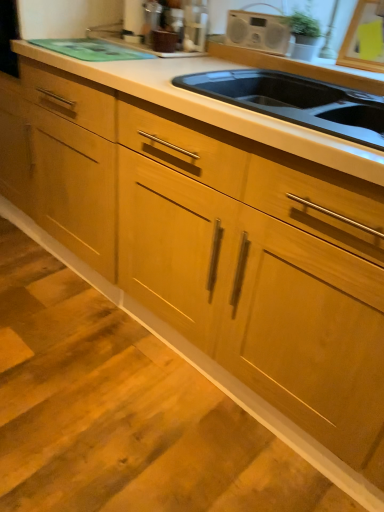
Question: Based on their positions, is metallic silver toaster at upper center located to the left or right of black matte sink at center?

Choices:
 (A) right
 (B) left

Answer: (B)

Question: Is point (188, 20) closer or farther from the camera than point (195, 91)?

Choices:
 (A) closer
 (B) farther

Answer: (B)

Question: Is metallic silver toaster at upper center taller or shorter than black matte sink at center?

Choices:
 (A) short
 (B) tall

Answer: (B)

Question: Based on their sizes in the image, would you say black matte sink at center is bigger or smaller than metallic silver toaster at upper center?

Choices:
 (A) small
 (B) big

Answer: (B)

Question: In terms of width, does black matte sink at center look wider or thinner when compared to metallic silver toaster at upper center?

Choices:
 (A) thin
 (B) wide

Answer: (B)

Question: In the image, is black matte sink at center on the left side or the right side of metallic silver toaster at upper center?

Choices:
 (A) left
 (B) right

Answer: (B)

Question: Choose the correct answer: Is black matte sink at center inside metallic silver toaster at upper center or outside it?

Choices:
 (A) outside
 (B) inside

Answer: (A)